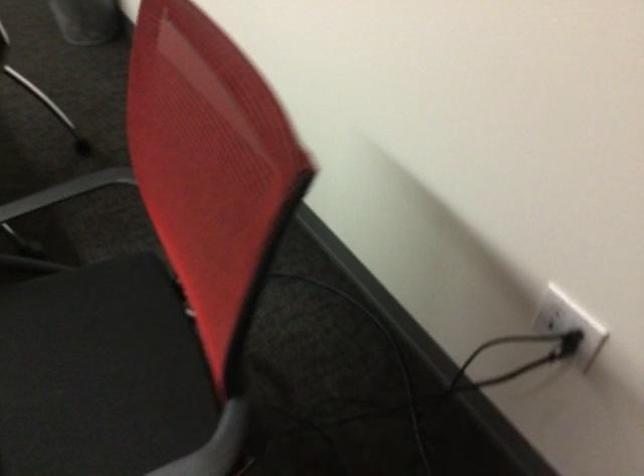
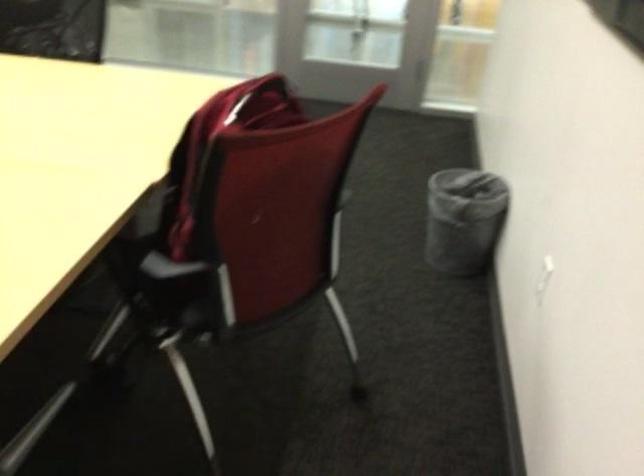
Question: The images are taken continuously from a first-person perspective. In which direction is your viewpoint rotating?

Choices:
 (A) Left
 (B) Right
 (C) Up
 (D) Down

Answer: (A)